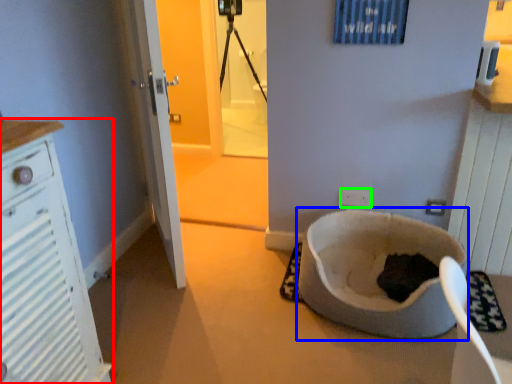
Question: Considering the real-world distances, which object is farthest from cabinetry (highlighted by a red box)? toilet bowl (highlighted by a blue box) or electric outlet (highlighted by a green box)?

Choices:
 (A) toilet bowl
 (B) electric outlet

Answer: (B)